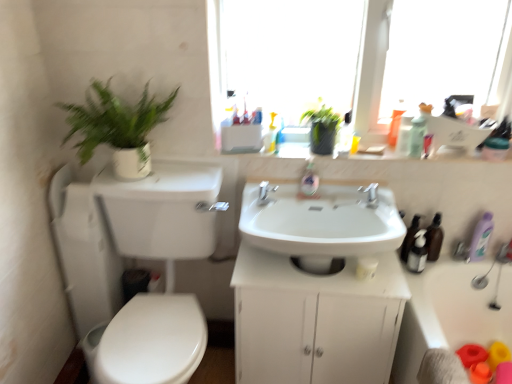
Question: Can you see green matte plant at left touching translucent plastic soap dispenser at center?

Choices:
 (A) yes
 (B) no

Answer: (B)

Question: Considering the relative sizes of green matte plant at left and translucent plastic soap dispenser at center in the image provided, is green matte plant at left thinner than translucent plastic soap dispenser at center?

Choices:
 (A) yes
 (B) no

Answer: (B)

Question: Can you confirm if green matte plant at left is positioned to the right of translucent plastic soap dispenser at center?

Choices:
 (A) no
 (B) yes

Answer: (A)

Question: Is translucent plastic soap dispenser at center located within green matte plant at left?

Choices:
 (A) yes
 (B) no

Answer: (B)

Question: Does green matte plant at left lie in front of translucent plastic soap dispenser at center?

Choices:
 (A) no
 (B) yes

Answer: (B)

Question: From a real-world perspective, is green matte plant at left positioned under translucent plastic soap dispenser at center based on gravity?

Choices:
 (A) no
 (B) yes

Answer: (A)

Question: Is yellow plastic bottle at upper center, placed as the sixth toiletry when sorted from right to left, positioned in front of transparent glass window at upper center?

Choices:
 (A) yes
 (B) no

Answer: (B)

Question: Is yellow plastic bottle at upper center, placed as the sixth toiletry when sorted from right to left, facing away from transparent glass window at upper center?

Choices:
 (A) no
 (B) yes

Answer: (B)

Question: From a real-world perspective, is yellow plastic bottle at upper center, which ranks as the 1th toiletry in left-to-right order, on top of transparent glass window at upper center?

Choices:
 (A) yes
 (B) no

Answer: (B)

Question: Considering the relative sizes of yellow plastic bottle at upper center, which ranks as the 1th toiletry in left-to-right order, and transparent glass window at upper center in the image provided, is yellow plastic bottle at upper center, which ranks as the 1th toiletry in left-to-right order, smaller than transparent glass window at upper center?

Choices:
 (A) yes
 (B) no

Answer: (A)

Question: Is transparent glass window at upper center surrounded by yellow plastic bottle at upper center, placed as the sixth toiletry when sorted from right to left?

Choices:
 (A) yes
 (B) no

Answer: (B)

Question: Does yellow plastic bottle at upper center, placed as the sixth toiletry when sorted from right to left, have a lesser width compared to transparent glass window at upper center?

Choices:
 (A) no
 (B) yes

Answer: (B)

Question: Considering the relative sizes of translucent orange soap dispenser at upper right, the fifth toiletry in the right-to-left sequence, and white plastic bathtub at lower right in the image provided, is translucent orange soap dispenser at upper right, the fifth toiletry in the right-to-left sequence, taller than white plastic bathtub at lower right?

Choices:
 (A) yes
 (B) no

Answer: (B)